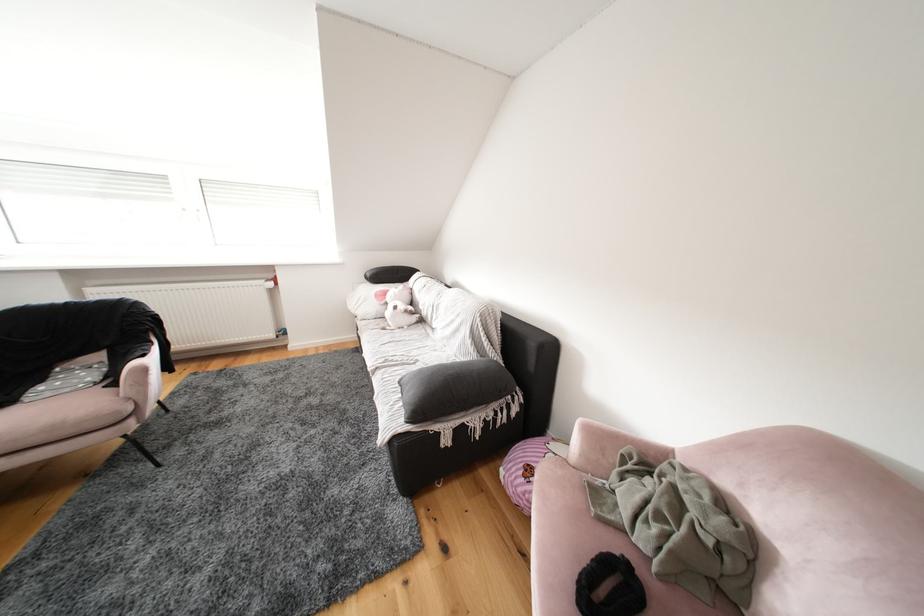
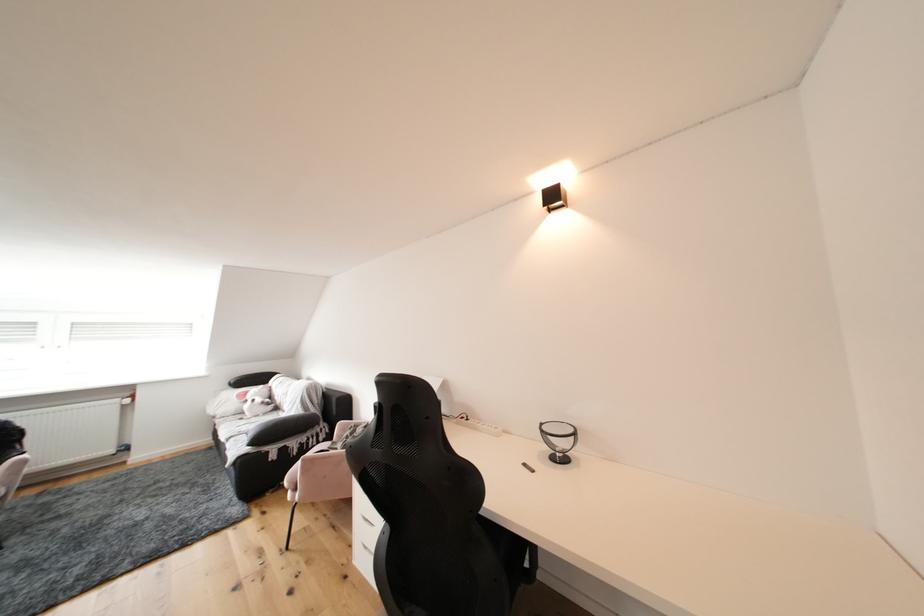
Where in the second image is the point corresponding to point 394,297 from the first image?

(256, 397)